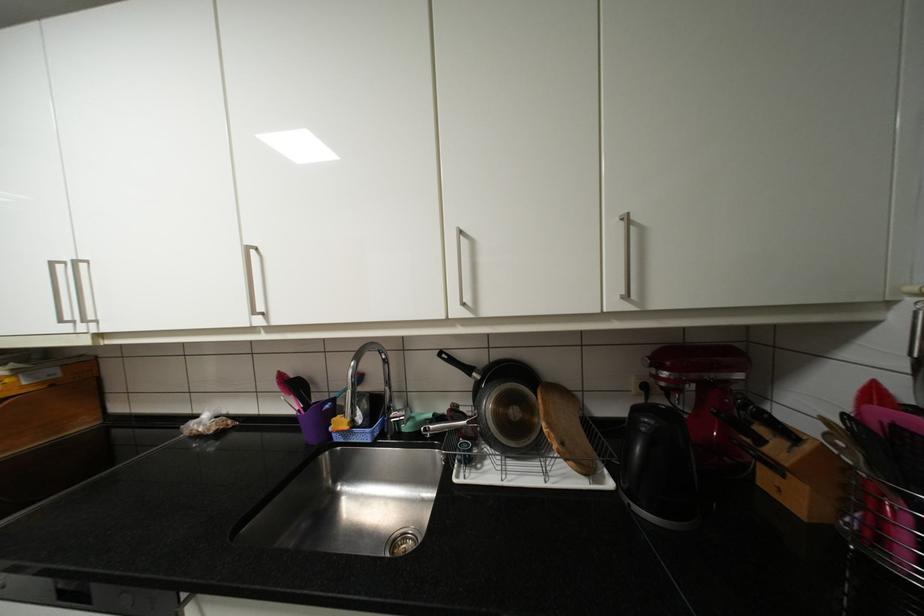
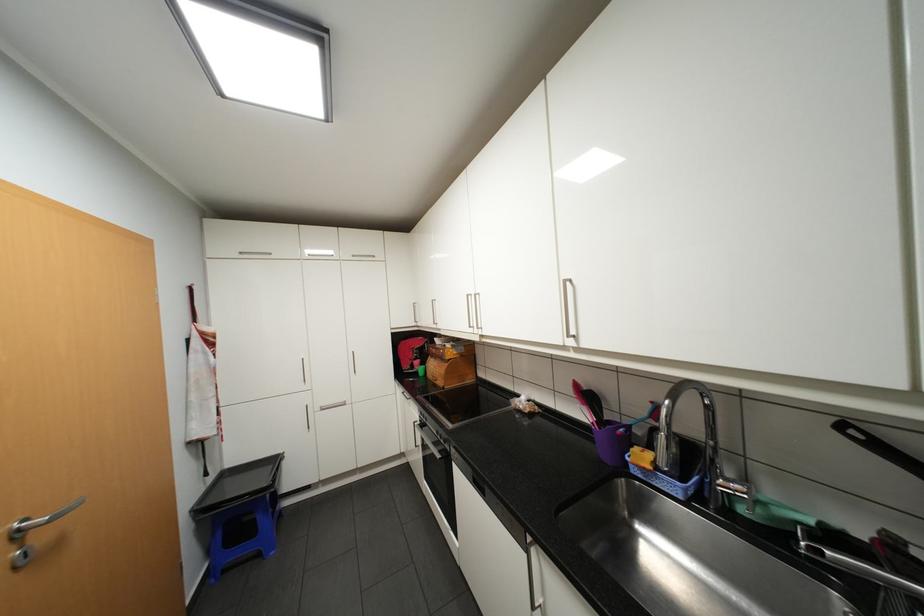
Where in the second image is the point corresponding to the point at 61,262 from the first image?

(476, 294)